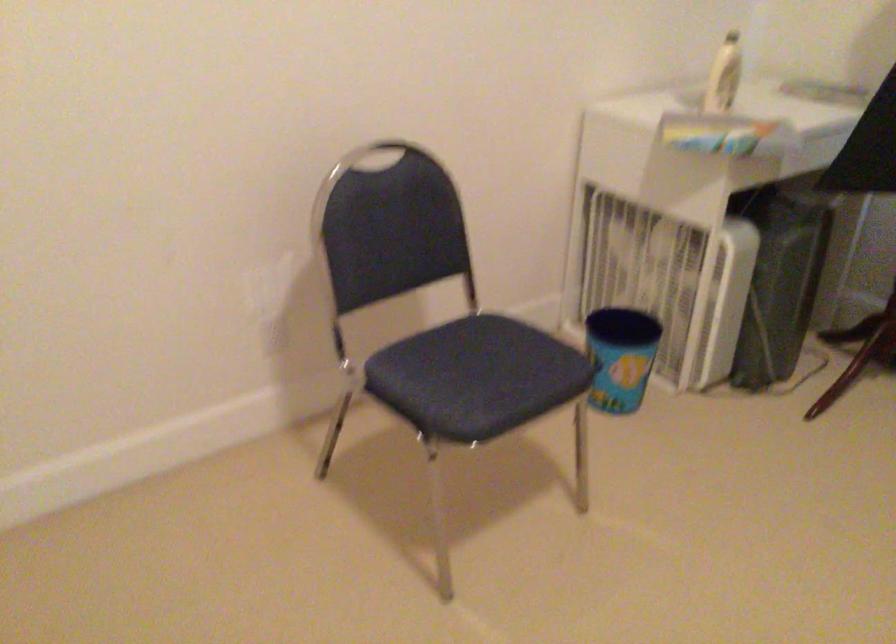
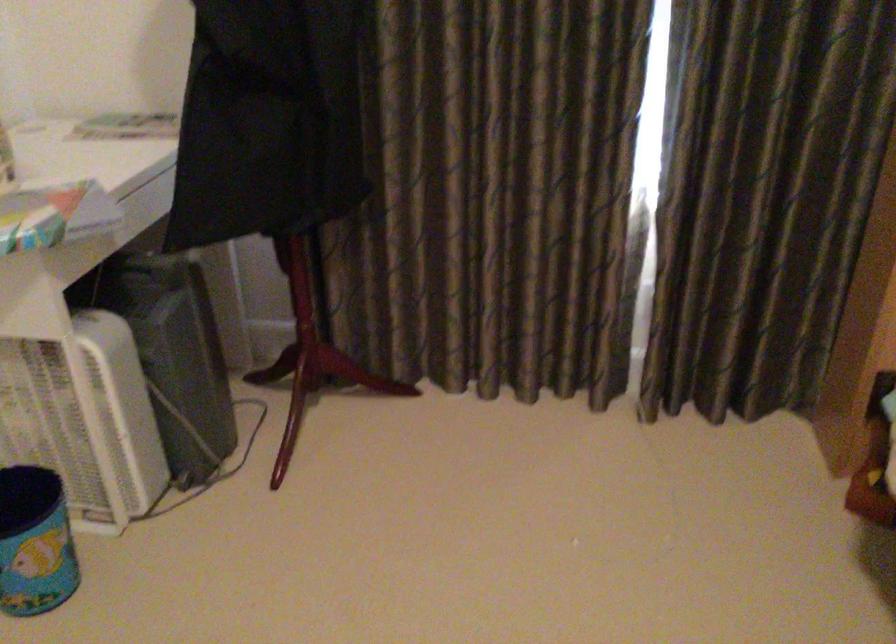
Locate, in the second image, the point that corresponds to (743,134) in the first image.

(54, 214)